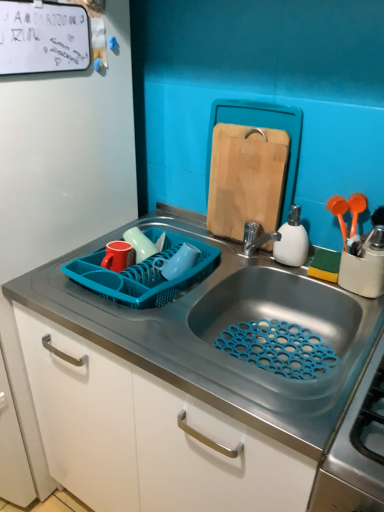
You are a GUI agent. You are given a task and a screenshot of the screen. Output one action in this format:
    pyautogui.click(x=<x>, y=<y>)
    Task: Click on the free region on the left part of wooden cutting board at upper center
    This screenshot has width=384, height=512.
    Given the screenshot: What is the action you would take?
    pyautogui.click(x=190, y=239)